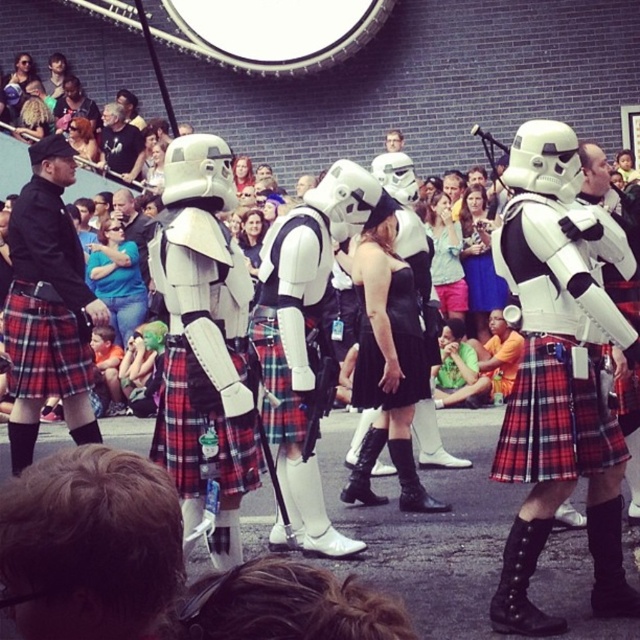
Can you confirm if black kilt at left is bigger than dark gray t-shirt at center?

Correct, black kilt at left is larger in size than dark gray t-shirt at center.

The width and height of the screenshot is (640, 640). Describe the element at coordinates (49, 307) in the screenshot. I see `black kilt at left` at that location.

Is point (65, 337) positioned before point (100, 154)?

Yes, it is in front of point (100, 154).

Where is `black kilt at left`? This screenshot has height=640, width=640. black kilt at left is located at coordinates 49,307.

Between point (557, 243) and point (545, 360), which one is positioned in front?

Point (557, 243) is more forward.

Who is more distant from viewer, (593, 380) or (515, 420)?

Point (515, 420)

This screenshot has width=640, height=640. Identify the location of white matte stormtrooper at center. (554, 348).

Measure the distance between plaid fabric kilt at center and dark gray t-shirt at center.

plaid fabric kilt at center and dark gray t-shirt at center are 44.63 meters apart from each other.

Does plaid fabric kilt at center appear on the left side of dark gray t-shirt at center?

No, plaid fabric kilt at center is not to the left of dark gray t-shirt at center.

The image size is (640, 640). I want to click on plaid fabric kilt at center, so click(556, 417).